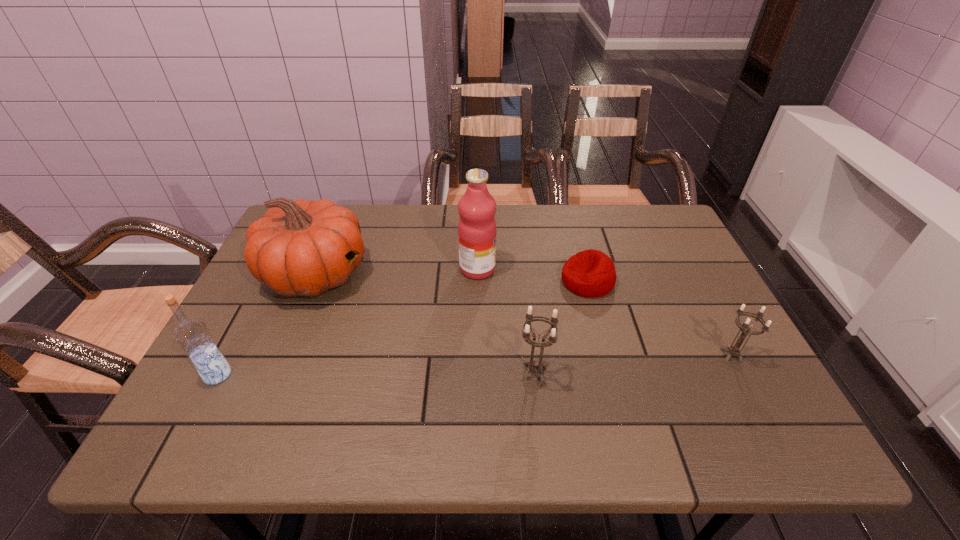
With all candle holders evenly spaced, where should an extra candle holder be placed on the left to continue the pattern? Please point out a vacant space. Please provide its 2D coordinates. Your answer should be formatted as a tuple, i.e. [(x, y)], where the tuple contains the x and y coordinates of a point satisfying the conditions above.

[(323, 392)]